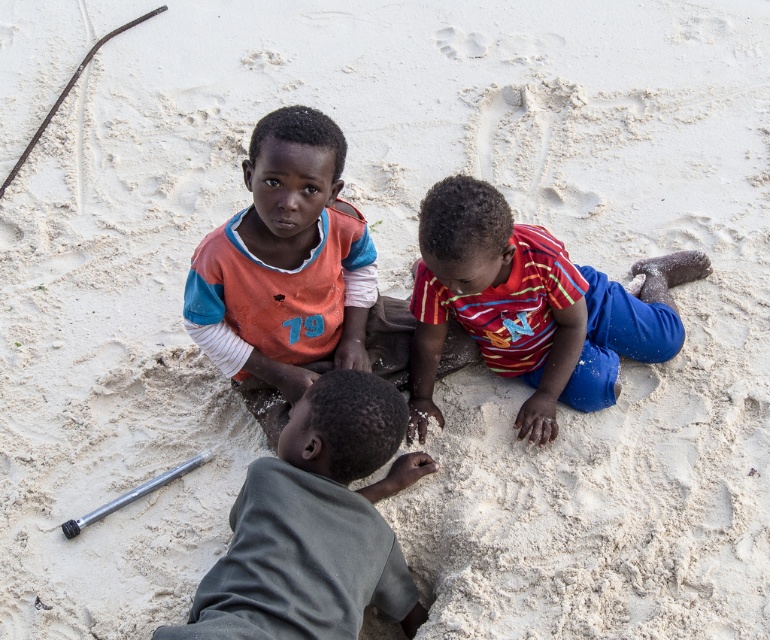
Question: Is orange jersey at center bigger than striped cotton shirt at center?

Choices:
 (A) no
 (B) yes

Answer: (A)

Question: Which point is closer to the camera?

Choices:
 (A) orange jersey at center
 (B) striped cotton shirt at center

Answer: (A)

Question: Is dark gray cotton shirt at lower left below striped cotton shirt at center?

Choices:
 (A) yes
 (B) no

Answer: (A)

Question: Estimate the real-world distances between objects in this image. Which object is farther from the dark gray cotton shirt at lower left?

Choices:
 (A) striped cotton shirt at center
 (B) orange jersey at center

Answer: (A)

Question: Which point is farther from the camera taking this photo?

Choices:
 (A) (308, 573)
 (B) (340, 262)
 (C) (422, 324)

Answer: (C)

Question: Can you confirm if orange jersey at center is smaller than striped cotton shirt at center?

Choices:
 (A) yes
 (B) no

Answer: (A)